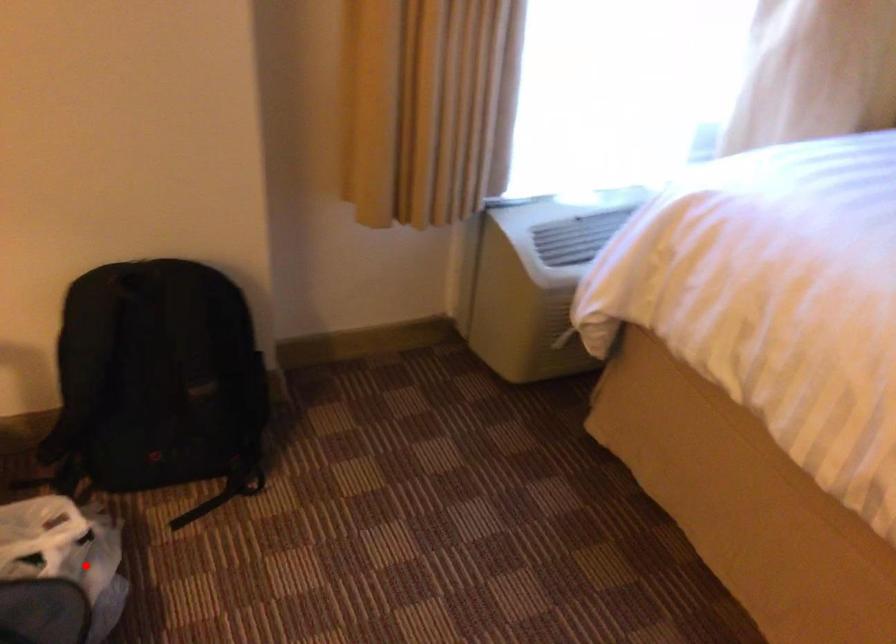
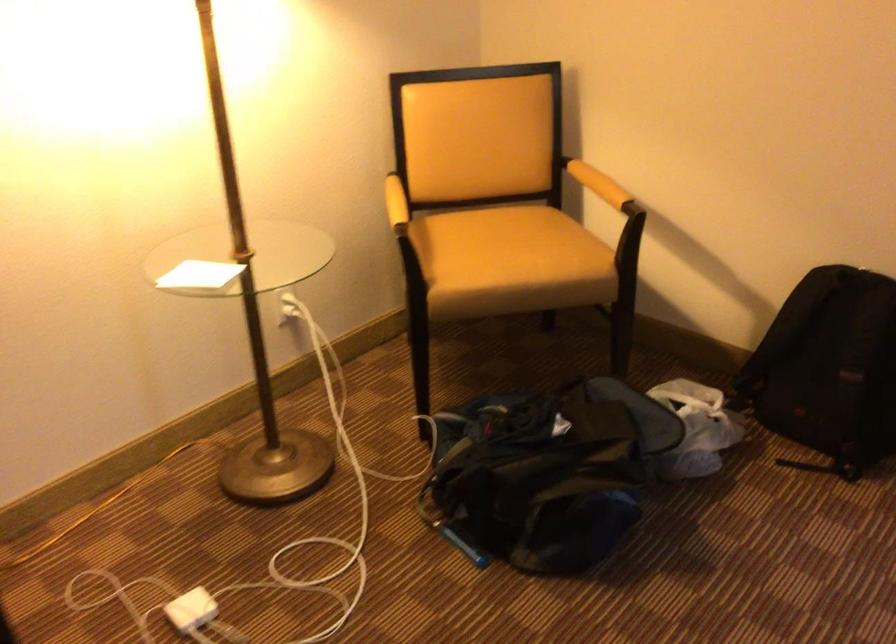
Question: I am providing you with two images of the same scene from different viewpoints. Image1 has a red point marked. In image2, the corresponding 3D location appears at what relative position? Reply with the corresponding letter.

Choices:
 (A) Closer
 (B) Farther

Answer: (B)